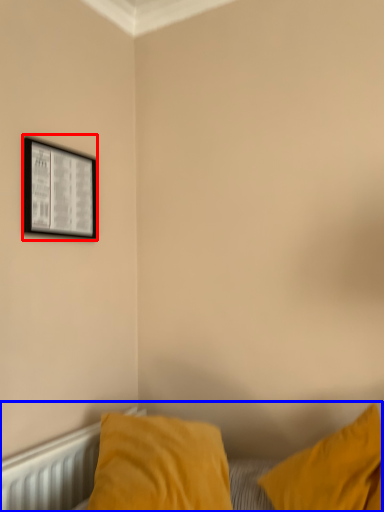
Question: Which object appears farthest to the camera in this image, picture frame (highlighted by a red box) or bed (highlighted by a blue box)?

Choices:
 (A) picture frame
 (B) bed

Answer: (A)